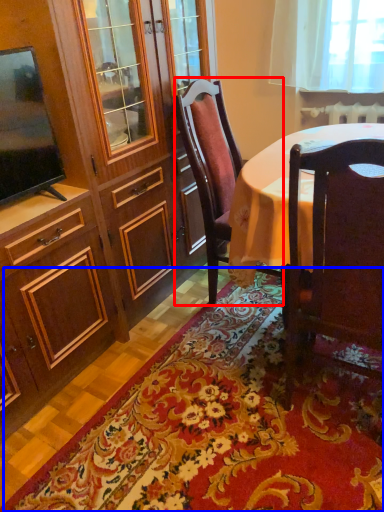
Question: Which object appears closest to the camera in this image, chair (highlighted by a red box) or mat (highlighted by a blue box)?

Choices:
 (A) chair
 (B) mat

Answer: (B)